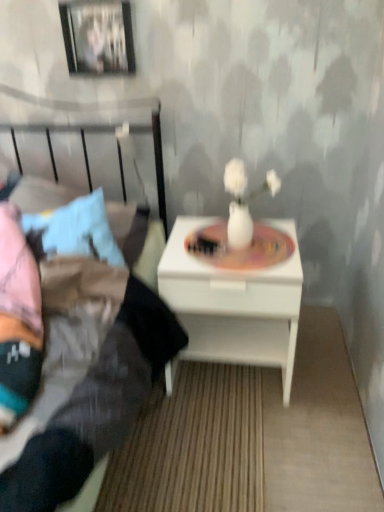
The width and height of the screenshot is (384, 512). Find the location of `blank space situated above matte white vase at center (from a real-world perspective)`. blank space situated above matte white vase at center (from a real-world perspective) is located at coordinates (241, 243).